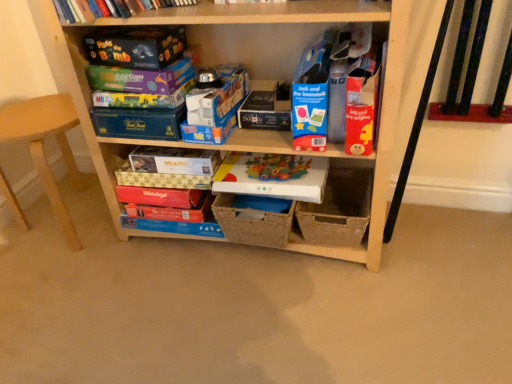
Question: From the image's perspective, would you say matte plastic board game at center, which is the 2th paperback book from bottom to top, is positioned over matte gold paperback book at center, the 3th paperback book in the bottom-to-top sequence?

Choices:
 (A) no
 (B) yes

Answer: (A)

Question: Is matte plastic board game at center, which is the 2th paperback book from bottom to top, far away from matte gold paperback book at center, the 3th paperback book in the bottom-to-top sequence?

Choices:
 (A) no
 (B) yes

Answer: (A)

Question: Can you confirm if matte plastic board game at center, positioned as the sixth paperback book in top-to-bottom order, is bigger than matte gold paperback book at center, arranged as the 5th paperback book when viewed from the top?

Choices:
 (A) yes
 (B) no

Answer: (A)

Question: Can matte gold paperback book at center, the 3th paperback book in the bottom-to-top sequence, be found inside matte plastic board game at center, which is the 2th paperback book from bottom to top?

Choices:
 (A) yes
 (B) no

Answer: (B)

Question: Are matte plastic board game at center, which is the 2th paperback book from bottom to top, and matte gold paperback book at center, arranged as the 5th paperback book when viewed from the top, making contact?

Choices:
 (A) no
 (B) yes

Answer: (A)

Question: From a real-world perspective, is matte gold paperback book at center, arranged as the 5th paperback book when viewed from the top, positioned above or below matt black game box at upper left, placed as the seventh paperback book when sorted from bottom to top?

Choices:
 (A) below
 (B) above

Answer: (A)

Question: In the image, is matte gold paperback book at center, arranged as the 5th paperback book when viewed from the top, positioned in front of or behind matt black game box at upper left, positioned as the 1th paperback book in top-to-bottom order?

Choices:
 (A) front
 (B) behind

Answer: (B)

Question: Looking at their shapes, would you say matte gold paperback book at center, the 3th paperback book in the bottom-to-top sequence, is wider or thinner than matt black game box at upper left, placed as the seventh paperback book when sorted from bottom to top?

Choices:
 (A) thin
 (B) wide

Answer: (B)

Question: From the image's perspective, is matte gold paperback book at center, the 3th paperback book in the bottom-to-top sequence, positioned above or below matt black game box at upper left, positioned as the 1th paperback book in top-to-bottom order?

Choices:
 (A) above
 (B) below

Answer: (B)

Question: In terms of size, does bright red cardboard book at upper center, the 4th paperback book from the bottom, appear bigger or smaller than natural woven basket at center, which is the 3th storage box in top-to-bottom order?

Choices:
 (A) small
 (B) big

Answer: (A)

Question: From the image's perspective, is bright red cardboard book at upper center, the 4th paperback book from the bottom, positioned above or below natural woven basket at center, which is the 3th storage box in top-to-bottom order?

Choices:
 (A) above
 (B) below

Answer: (A)

Question: Based on their positions, is bright red cardboard book at upper center, the 4th paperback book from the top, located to the left or right of natural woven basket at center, which is the 3th storage box in top-to-bottom order?

Choices:
 (A) left
 (B) right

Answer: (B)

Question: Is bright red cardboard book at upper center, the 4th paperback book from the bottom, inside the boundaries of natural woven basket at center, which is the 3th storage box in top-to-bottom order, or outside?

Choices:
 (A) inside
 (B) outside

Answer: (B)

Question: Is bright red cardboard book at upper center, the 4th paperback book from the top, inside the boundaries of matte plastic board game at center, positioned as the sixth paperback book in top-to-bottom order, or outside?

Choices:
 (A) inside
 (B) outside

Answer: (B)

Question: From a real-world perspective, is bright red cardboard book at upper center, the 4th paperback book from the top, above or below matte plastic board game at center, which is the 2th paperback book from bottom to top?

Choices:
 (A) above
 (B) below

Answer: (A)